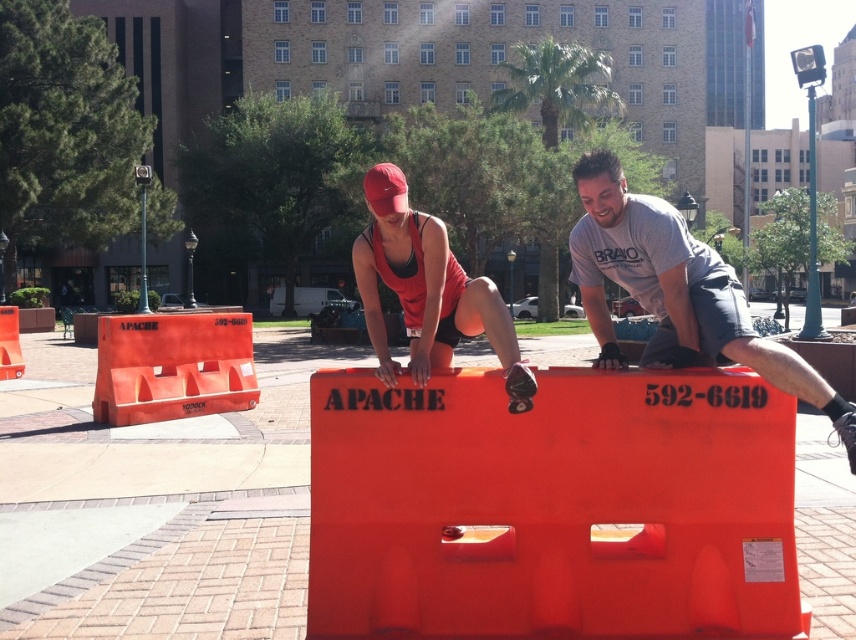
Question: Which object appears farthest from the camera in this image?

Choices:
 (A) orange plastic hurdle at center
 (B) matte gray t-shirt at center
 (C) matte orange helmet at center

Answer: (C)

Question: Which point appears farthest from the camera in this image?

Choices:
 (A) (379, 579)
 (B) (693, 326)
 (C) (426, 218)

Answer: (B)

Question: Does matte gray t-shirt at center appear on the right side of matte orange helmet at center?

Choices:
 (A) no
 (B) yes

Answer: (B)

Question: Can you confirm if orange plastic hurdle at center is positioned to the left of matte gray t-shirt at center?

Choices:
 (A) no
 (B) yes

Answer: (B)

Question: Which of the following is the closest to the observer?

Choices:
 (A) (658, 544)
 (B) (587, 188)
 (C) (377, 195)

Answer: (C)

Question: Does matte gray t-shirt at center have a larger size compared to matte orange helmet at center?

Choices:
 (A) yes
 (B) no

Answer: (A)